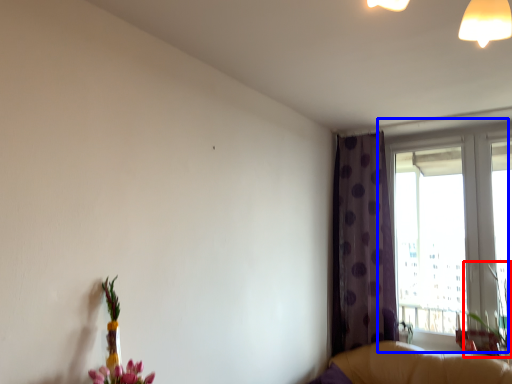
Question: Which object appears farthest to the camera in this image, plant (highlighted by a red box) or window (highlighted by a blue box)?

Choices:
 (A) plant
 (B) window

Answer: (B)